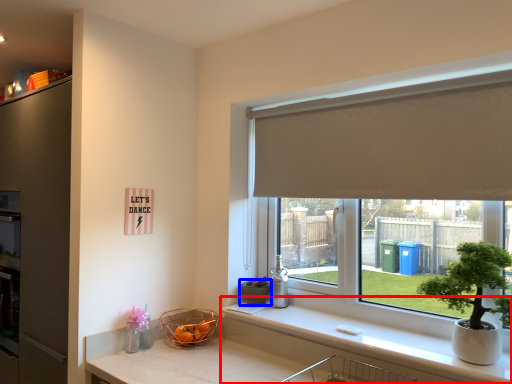
Question: Which object is further to the camera taking this photo, counter top (highlighted by a red box) or flowerpot (highlighted by a blue box)?

Choices:
 (A) counter top
 (B) flowerpot

Answer: (B)